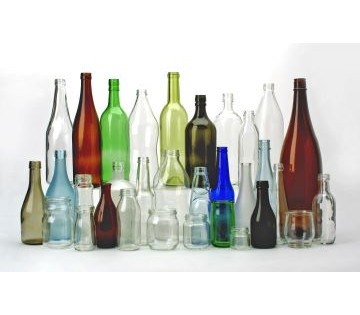
Locate an element on the screen. The height and width of the screenshot is (315, 360). glass jars is located at coordinates (55, 225), (83, 234), (84, 193), (132, 225), (164, 233), (194, 234), (219, 225), (236, 238).